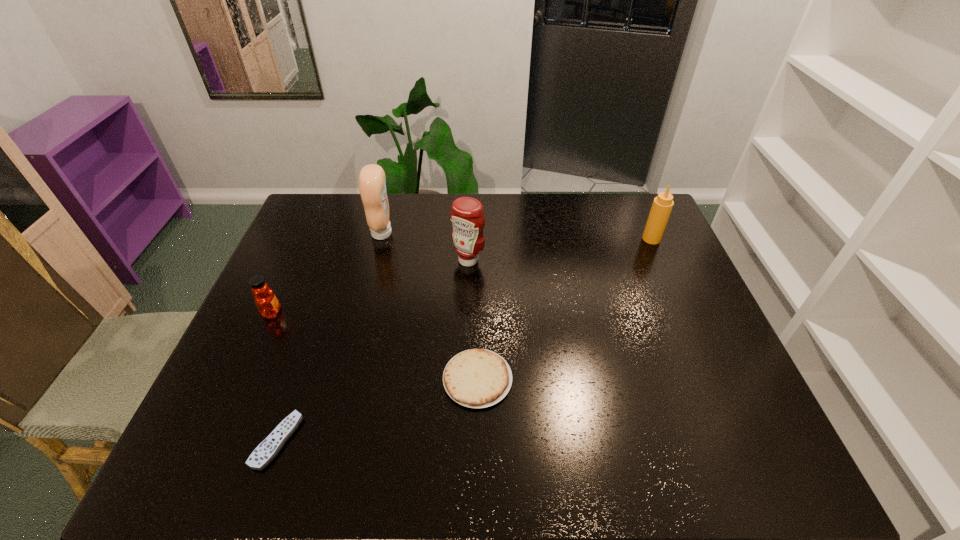
The height and width of the screenshot is (540, 960). Find the location of `the fourth object from right to left`. the fourth object from right to left is located at coordinates (372, 182).

The image size is (960, 540). I want to click on the third farthest object, so click(x=467, y=216).

Locate an element on the screen. The height and width of the screenshot is (540, 960). the second condiment from right to left is located at coordinates (467, 216).

Locate an element on the screen. the rightmost object is located at coordinates (662, 205).

You are a GUI agent. You are given a task and a screenshot of the screen. Output one action in this format:
    pyautogui.click(x=<x>, y=<y>)
    Task: Click on the fourth tallest object
    The width and height of the screenshot is (960, 540).
    Given the screenshot: What is the action you would take?
    pyautogui.click(x=266, y=302)

I want to click on the third nearest object, so click(x=266, y=302).

The width and height of the screenshot is (960, 540). Find the location of `the second nearest object`. the second nearest object is located at coordinates (476, 378).

This screenshot has height=540, width=960. I want to click on the second shortest object, so click(x=476, y=378).

Locate an element on the screen. the shortest object is located at coordinates (266, 451).

Identify the location of the second object from left to right. The height and width of the screenshot is (540, 960). (266, 451).